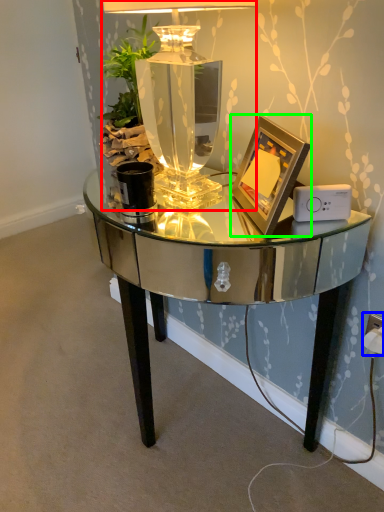
Question: Which object is positioned closest to table lamp (highlighted by a red box)? Select from electric outlet (highlighted by a blue box) and picture frame (highlighted by a green box).

Choices:
 (A) electric outlet
 (B) picture frame

Answer: (B)